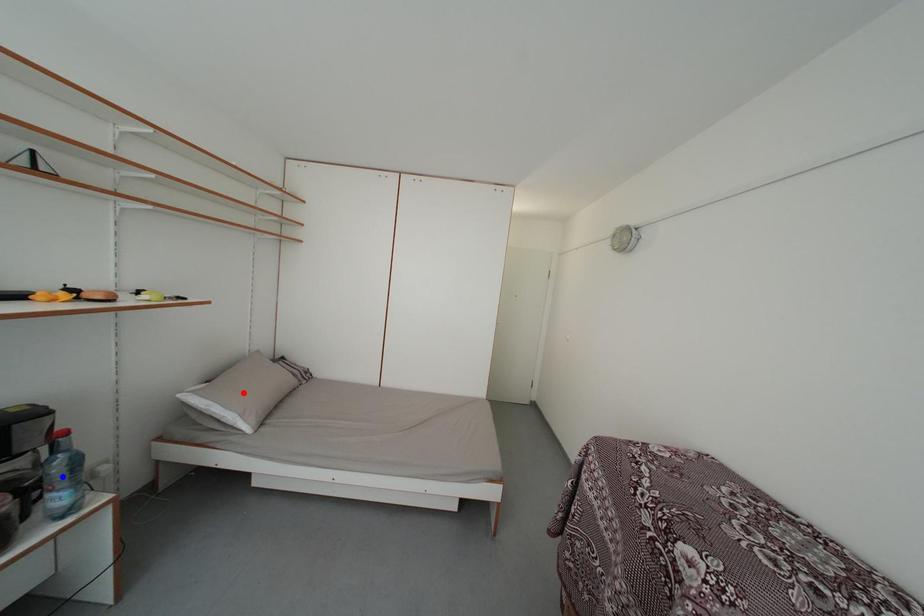
Question: Which of the two points in the image is closer to the camera?

Choices:
 (A) Blue point is closer.
 (B) Red point is closer.

Answer: (A)